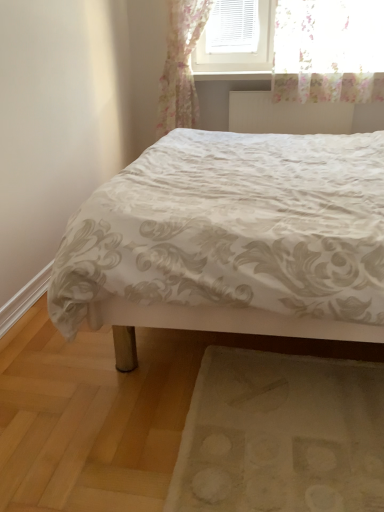
I want to click on free space to the left of beige fabric mat at lower right, so click(x=108, y=408).